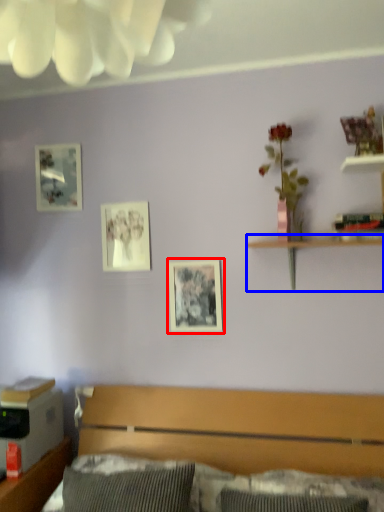
Question: Which object appears farthest to the camera in this image, picture frame (highlighted by a red box) or shelf (highlighted by a blue box)?

Choices:
 (A) picture frame
 (B) shelf

Answer: (A)